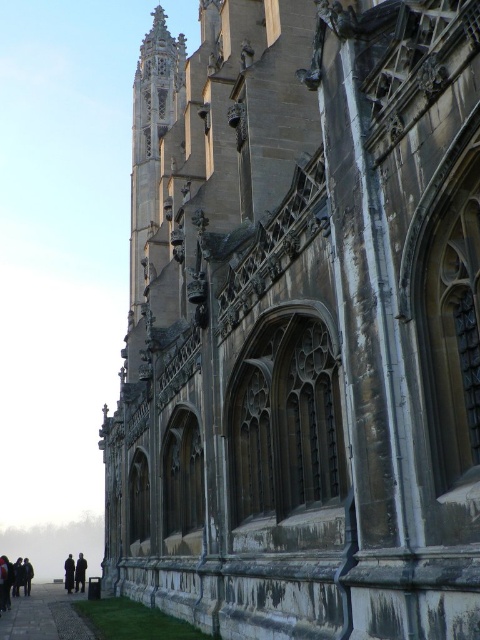
Is paved stone path at lower left further to camera compared to dark gray jacket at lower left?

No, paved stone path at lower left is closer to the viewer.

Can you confirm if paved stone path at lower left is bigger than dark gray jacket at lower left?

Actually, paved stone path at lower left might be smaller than dark gray jacket at lower left.

The height and width of the screenshot is (640, 480). Describe the element at coordinates (44, 616) in the screenshot. I see `paved stone path at lower left` at that location.

The width and height of the screenshot is (480, 640). Identify the location of paved stone path at lower left. (44, 616).

Which is above, paved stone path at lower left or dark gray coat at lower left?

paved stone path at lower left

In order to click on paved stone path at lower left in this screenshot , I will do `click(44, 616)`.

Locate an element on the screen. This screenshot has height=640, width=480. paved stone path at lower left is located at coordinates (44, 616).

In the scene shown: Is dark brown coat at lower left below dark gray coat at lower left?

No, dark brown coat at lower left is not below dark gray coat at lower left.

Find the location of a particular element. The image size is (480, 640). dark brown coat at lower left is located at coordinates (80, 572).

Where is `dark brown coat at lower left`? This screenshot has height=640, width=480. dark brown coat at lower left is located at coordinates pyautogui.click(x=80, y=572).

This screenshot has height=640, width=480. I want to click on dark brown coat at lower left, so [80, 572].